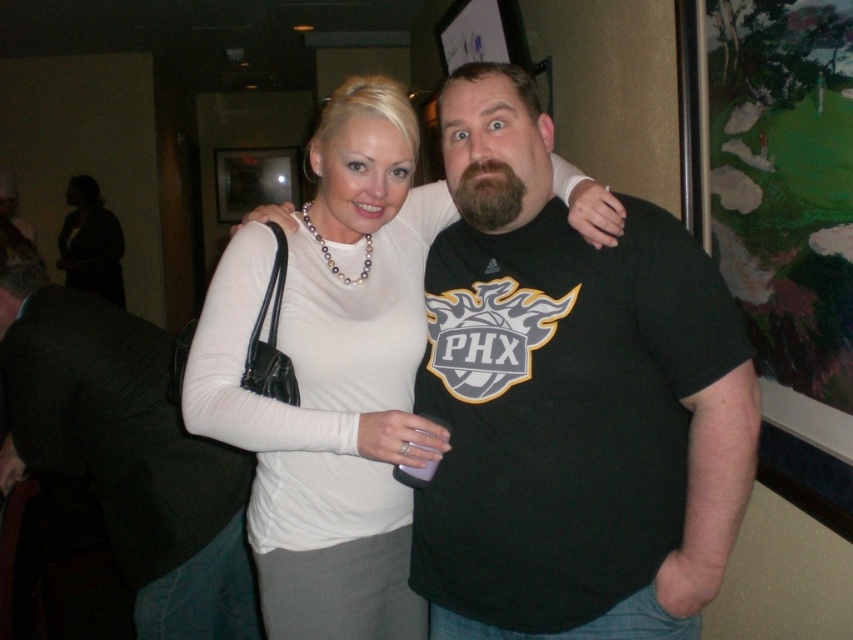
Question: Where is white pearl necklace at upper center located in relation to black matte jacket at center in the image?

Choices:
 (A) below
 (B) above

Answer: (B)

Question: Is the position of black matte jacket at center less distant than that of matte white blouse at upper center?

Choices:
 (A) no
 (B) yes

Answer: (B)

Question: Which object appears closest to the camera in this image?

Choices:
 (A) white pearl necklace at upper center
 (B) black matte jacket at center

Answer: (A)

Question: Where is black matte jacket at center located in relation to matte white blouse at upper center in the image?

Choices:
 (A) left
 (B) right

Answer: (B)

Question: Which point appears closest to the camera in this image?

Choices:
 (A) (96, 280)
 (B) (15, 266)
 (C) (231, 268)

Answer: (C)

Question: Based on their relative distances, which object is farther from the matte white blouse at upper center?

Choices:
 (A) white pearl necklace at upper center
 (B) black matte jacket at center

Answer: (A)